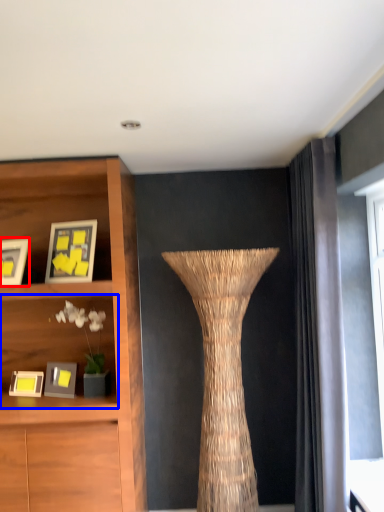
Question: Which of the following is the closest to the observer, picture frame (highlighted by a red box) or shelf (highlighted by a blue box)?

Choices:
 (A) picture frame
 (B) shelf

Answer: (A)